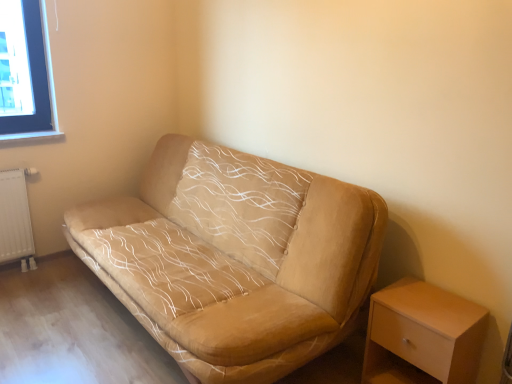
Identify the location of free point above white matte wooden table at lower right (from a real-world perspective). The height and width of the screenshot is (384, 512). click(x=425, y=300).